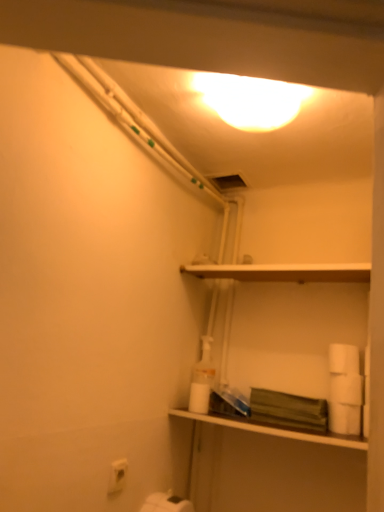
Where is `vacant area located to the right-hand side of white matte toilet paper at lower center, which is the 2th toilet paper from left to right`? This screenshot has height=512, width=384. vacant area located to the right-hand side of white matte toilet paper at lower center, which is the 2th toilet paper from left to right is located at coordinates (242, 418).